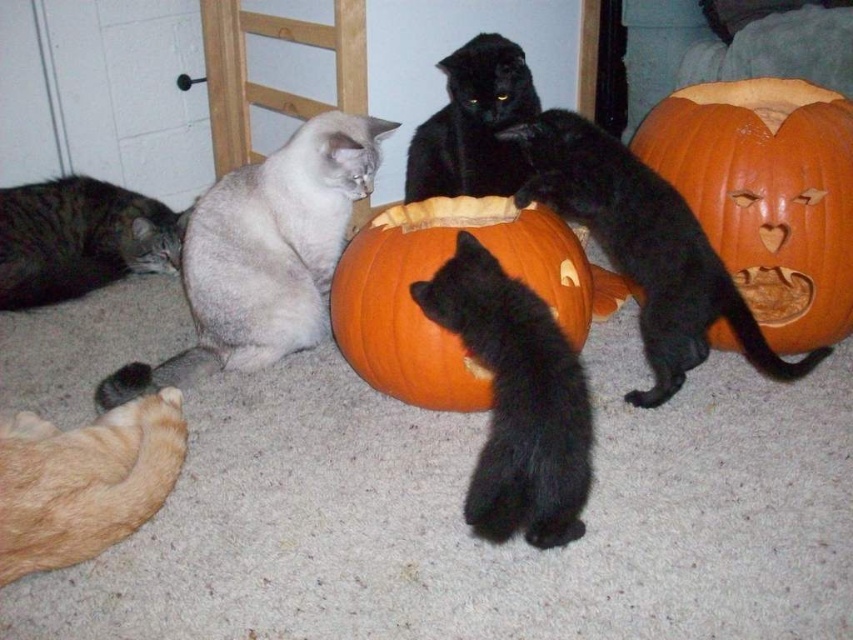
Is silvery fur cat at center bigger than black fur cat at center?

Yes, silvery fur cat at center is bigger than black fur cat at center.

Is silvery fur cat at center above black fur cat at center?

Correct, silvery fur cat at center is located above black fur cat at center.

Who is more forward, (218,220) or (469,234)?

Positioned in front is point (469,234).

Locate an element on the screen. The height and width of the screenshot is (640, 853). silvery fur cat at center is located at coordinates (265, 253).

Who is positioned more to the right, orange carved pumpkin at center or silvery fur cat at center?

orange carved pumpkin at center is more to the right.

Looking at this image, between orange carved pumpkin at center and silvery fur cat at center, which one is positioned higher?

orange carved pumpkin at center

Measure the distance between point (827, 182) and camera.

5.47 feet

You are a GUI agent. You are given a task and a screenshot of the screen. Output one action in this format:
    pyautogui.click(x=<x>, y=<y>)
    Task: Click on the orange carved pumpkin at center
    
    Given the screenshot: What is the action you would take?
    pyautogui.click(x=766, y=195)

Who is more distant from viewer, (697, 176) or (171, 248)?

The point (171, 248) is behind.

Locate an element on the screen. orange carved pumpkin at center is located at coordinates (766, 195).

This screenshot has height=640, width=853. Find the location of `orange carved pumpkin at center`. orange carved pumpkin at center is located at coordinates (766, 195).